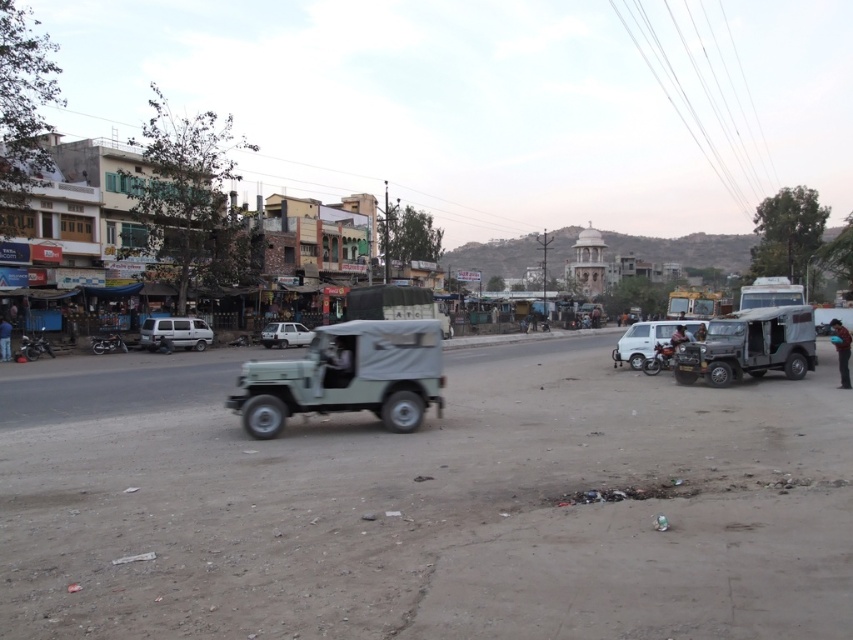
You are a GUI agent. You are given a task and a screenshot of the screen. Output one action in this format:
    pyautogui.click(x=<x>, y=<y>)
    Task: Click on the light green canvas jeep at center
    The width and height of the screenshot is (853, 640).
    Given the screenshot: What is the action you would take?
    pyautogui.click(x=347, y=376)

Is light green canvas jeep at center positioned at the back of blue jeans at lower left?

No, light green canvas jeep at center is closer to the viewer.

Who is more distant from viewer, (328, 388) or (4, 360)?

Positioned behind is point (4, 360).

I want to click on light green canvas jeep at center, so click(x=347, y=376).

Who is taller, light green canvas jeep at center or shiny metallic motorcycle at center-right?

light green canvas jeep at center is taller.

Locate an element on the screen. light green canvas jeep at center is located at coordinates (347, 376).

Can you confirm if shiny metallic motorcycle at center-right is thinner than blue jeans at lower left?

In fact, shiny metallic motorcycle at center-right might be wider than blue jeans at lower left.

At what (x,y) coordinates should I click in order to perform the action: click on shiny metallic motorcycle at center-right. Please return your answer as a coordinate pair (x, y). Looking at the image, I should click on (660, 356).